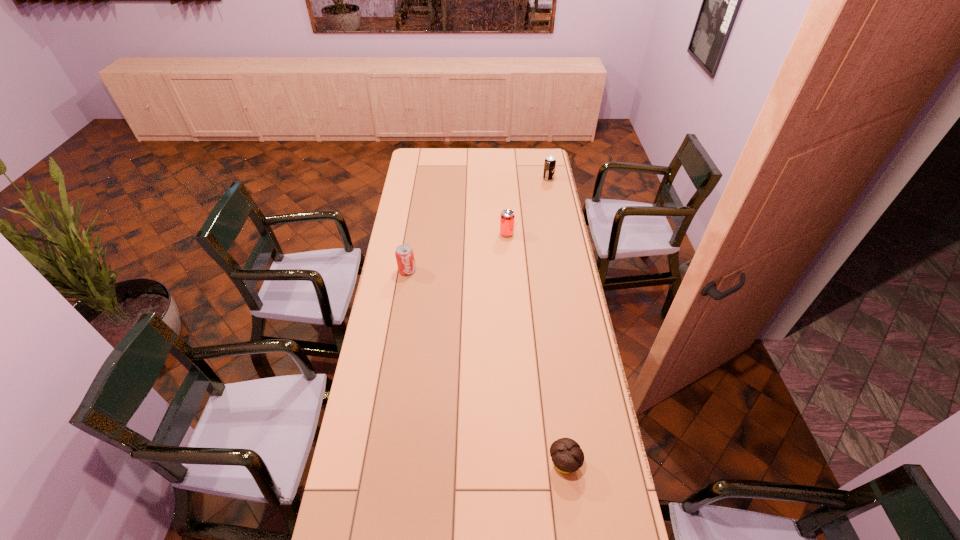
You are a GUI agent. You are given a task and a screenshot of the screen. Output one action in this format:
    pyautogui.click(x=<x>, y=<y>)
    Task: Click on the vacant space situated 0.200m on the left of the rightmost object
    Image resolution: width=960 pixels, height=540 pixels.
    Given the screenshot: What is the action you would take?
    pyautogui.click(x=507, y=179)

I want to click on vacant region located 0.260m on the left of the nearest object, so click(x=465, y=464).

Where is `object located in the left edge section of the desktop`? This screenshot has height=540, width=960. object located in the left edge section of the desktop is located at coordinates (404, 253).

The height and width of the screenshot is (540, 960). Identify the location of soda can that is at the right edge. (550, 163).

Where is `muffin located in the right edge section of the desktop`? This screenshot has height=540, width=960. muffin located in the right edge section of the desktop is located at coordinates [x=567, y=456].

The width and height of the screenshot is (960, 540). In the image, there is a desktop. What are the coordinates of `vacant space at the far edge` in the screenshot? It's located at (502, 160).

Where is `free space at the left edge of the desktop`? This screenshot has height=540, width=960. free space at the left edge of the desktop is located at coordinates (390, 261).

I want to click on vacant area at the right edge, so click(552, 213).

Image resolution: width=960 pixels, height=540 pixels. In order to click on unoccupied position between the leftmost object and the shortest object in this screenshot , I will do `click(486, 367)`.

Identify the location of free point between the second farthest object and the rightmost object. This screenshot has height=540, width=960. (527, 206).